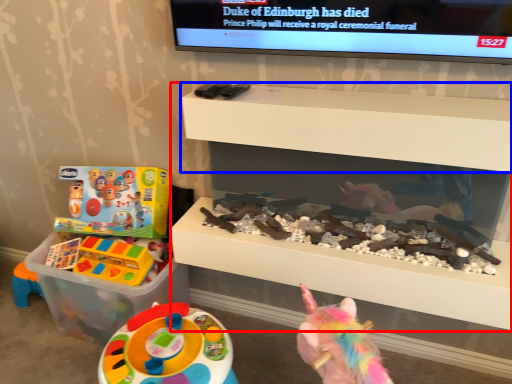
Question: Among these objects, which one is farthest to the camera, shelf (highlighted by a red box) or shelf (highlighted by a blue box)?

Choices:
 (A) shelf
 (B) shelf

Answer: (A)